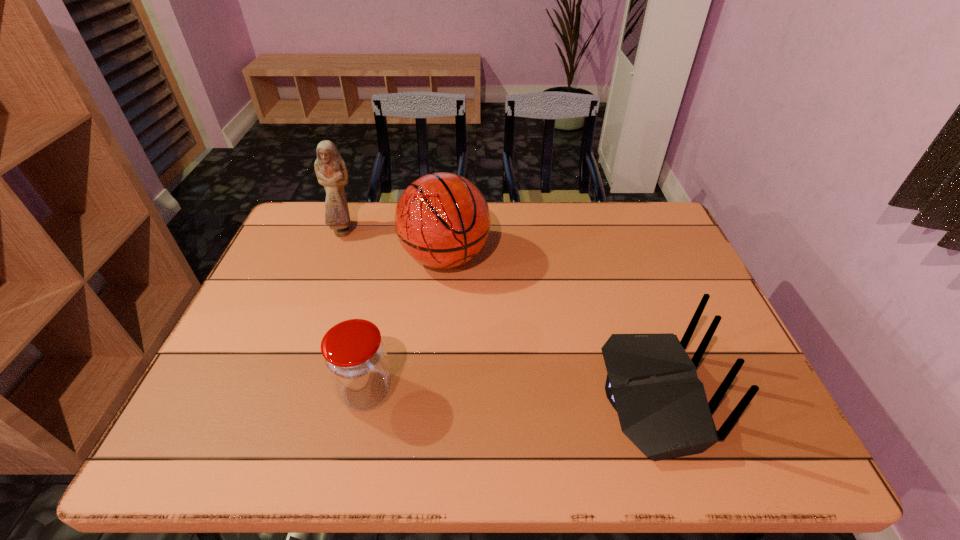
Where is `vacant spot on the desktop that is between the jar and the rightmost object and is positioned on the side with spill of the basketball`? The height and width of the screenshot is (540, 960). vacant spot on the desktop that is between the jar and the rightmost object and is positioned on the side with spill of the basketball is located at coordinates (516, 394).

Image resolution: width=960 pixels, height=540 pixels. In order to click on free space on the desktop that is between the jar and the rightmost object and is positioned on the front-facing side of the leftmost object in this screenshot , I will do `click(468, 393)`.